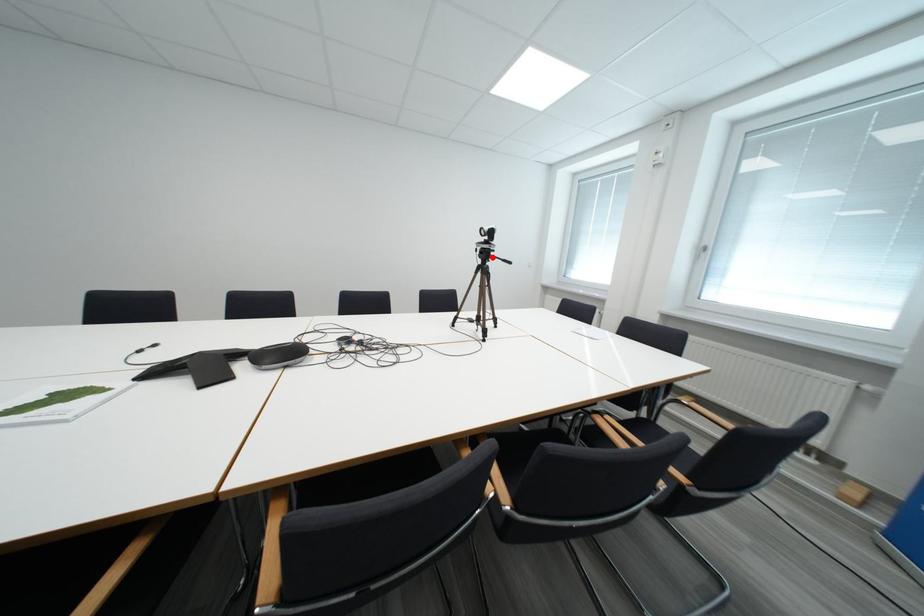
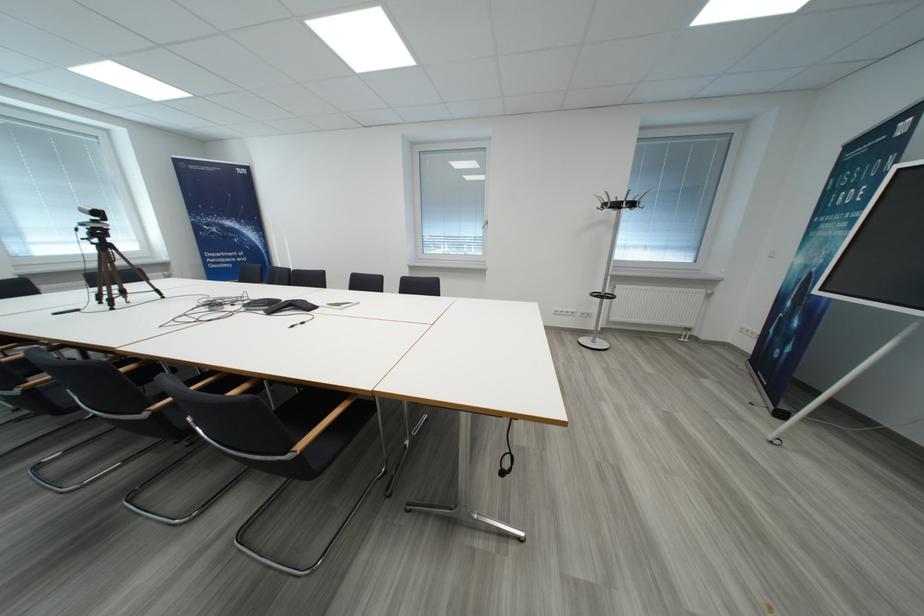
In the second image, find the point that corresponds to the highlighted location in the first image.

(106, 236)